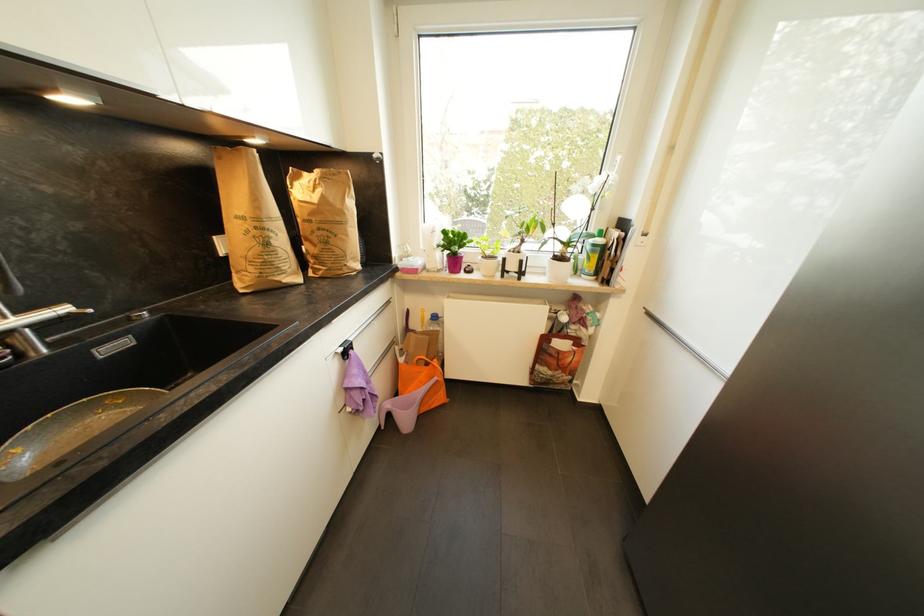
Find where to lift the pink plant pot. Please return your answer as a coordinate pair (x, y).

(454, 248)